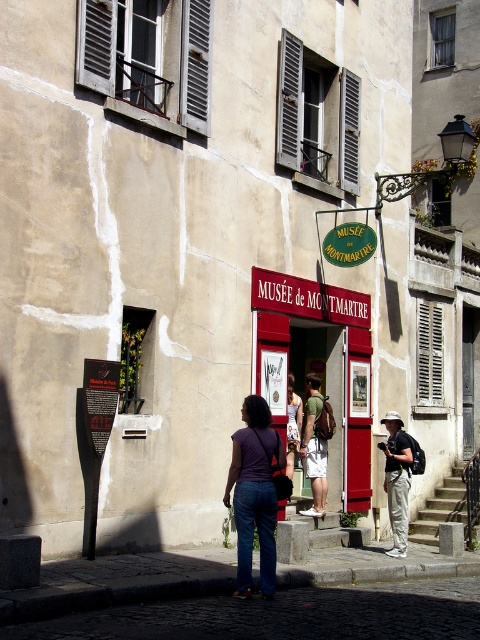
Between purple cotton shirt at center and denim pants at center, which one appears on the right side from the viewer's perspective?

From the viewer's perspective, denim pants at center appears more on the right side.

Who is taller, purple cotton shirt at center or denim pants at center?

Standing taller between the two is purple cotton shirt at center.

The height and width of the screenshot is (640, 480). What do you see at coordinates (254, 493) in the screenshot?
I see `purple cotton shirt at center` at bounding box center [254, 493].

Where is `purple cotton shirt at center`? purple cotton shirt at center is located at coordinates (254, 493).

Identify the location of khaki cotton pants at center. This screenshot has width=480, height=640. (396, 481).

Is point (407, 529) in front of point (325, 484)?

Yes.

Locate an element on the screen. Image resolution: width=480 pixels, height=640 pixels. khaki cotton pants at center is located at coordinates (396, 481).

In the scene shown: Is purple cotton shirt at center further to the viewer compared to green fabric shorts at center?

No.

Can you confirm if purple cotton shirt at center is positioned below green fabric shorts at center?

No.

The width and height of the screenshot is (480, 640). What do you see at coordinates (254, 493) in the screenshot?
I see `purple cotton shirt at center` at bounding box center [254, 493].

Where is `purple cotton shirt at center`? The width and height of the screenshot is (480, 640). purple cotton shirt at center is located at coordinates (254, 493).